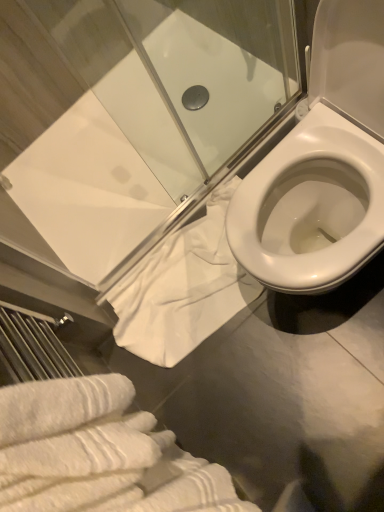
Question: Considering the relative sizes of white cotton towel at lower center, which is the 2th bath towel from front to back, and white textured bath towel at lower left, which is counted as the second bath towel, starting from the back, in the image provided, is white cotton towel at lower center, which is the 2th bath towel from front to back, taller than white textured bath towel at lower left, which is counted as the second bath towel, starting from the back,?

Choices:
 (A) yes
 (B) no

Answer: (B)

Question: Is white cotton towel at lower center, which is the 2th bath towel from front to back, to the right of white textured bath towel at lower left, which is counted as the second bath towel, starting from the back, from the viewer's perspective?

Choices:
 (A) yes
 (B) no

Answer: (A)

Question: Is white cotton towel at lower center, which is the 2th bath towel from front to back, facing towards white textured bath towel at lower left, which is counted as the second bath towel, starting from the back?

Choices:
 (A) no
 (B) yes

Answer: (A)

Question: Is white cotton towel at lower center, which is the 2th bath towel from front to back, beside white textured bath towel at lower left, the first bath towel in the front-to-back sequence?

Choices:
 (A) yes
 (B) no

Answer: (B)

Question: Is white cotton towel at lower center, acting as the first bath towel starting from the back, located outside white textured bath towel at lower left, the first bath towel in the front-to-back sequence?

Choices:
 (A) no
 (B) yes

Answer: (B)

Question: Based on their positions, is white cotton towel at lower center, which is the 2th bath towel from front to back, located to the left or right of transparent glass shower door at upper center?

Choices:
 (A) right
 (B) left

Answer: (A)

Question: From the image's perspective, is white cotton towel at lower center, which is the 2th bath towel from front to back, positioned above or below transparent glass shower door at upper center?

Choices:
 (A) below
 (B) above

Answer: (A)

Question: Is white cotton towel at lower center, acting as the first bath towel starting from the back, bigger or smaller than transparent glass shower door at upper center?

Choices:
 (A) big
 (B) small

Answer: (B)

Question: In terms of height, does white cotton towel at lower center, acting as the first bath towel starting from the back, look taller or shorter compared to transparent glass shower door at upper center?

Choices:
 (A) tall
 (B) short

Answer: (B)

Question: Visually, is white cotton towel at lower center, which is the 2th bath towel from front to back, positioned to the left or to the right of white textured bath towel at lower left, the first bath towel in the front-to-back sequence?

Choices:
 (A) right
 (B) left

Answer: (A)

Question: Is white cotton towel at lower center, which is the 2th bath towel from front to back, inside or outside of white textured bath towel at lower left, which is counted as the second bath towel, starting from the back?

Choices:
 (A) inside
 (B) outside

Answer: (B)

Question: Considering the positions of white cotton towel at lower center, acting as the first bath towel starting from the back, and white textured bath towel at lower left, the first bath towel in the front-to-back sequence, in the image, is white cotton towel at lower center, acting as the first bath towel starting from the back, wider or thinner than white textured bath towel at lower left, the first bath towel in the front-to-back sequence,?

Choices:
 (A) wide
 (B) thin

Answer: (A)

Question: Considering the positions of point (160, 263) and point (4, 432), is point (160, 263) closer or farther from the camera than point (4, 432)?

Choices:
 (A) farther
 (B) closer

Answer: (A)

Question: From the image's perspective, is white textured bath towel at lower left, which is counted as the second bath towel, starting from the back, located above or below transparent glass shower door at upper center?

Choices:
 (A) below
 (B) above

Answer: (A)

Question: Is white textured bath towel at lower left, which is counted as the second bath towel, starting from the back, taller or shorter than transparent glass shower door at upper center?

Choices:
 (A) tall
 (B) short

Answer: (B)